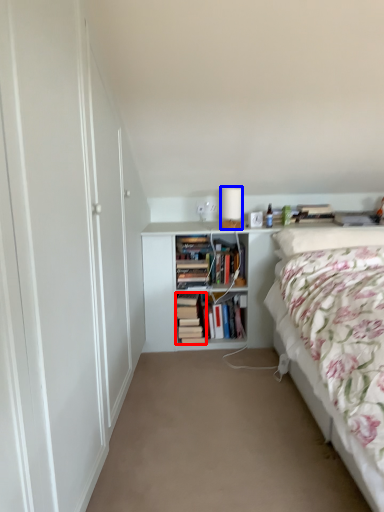
Question: Among these objects, which one is nearest to the camera, book (highlighted by a red box) or table lamp (highlighted by a blue box)?

Choices:
 (A) book
 (B) table lamp

Answer: (B)